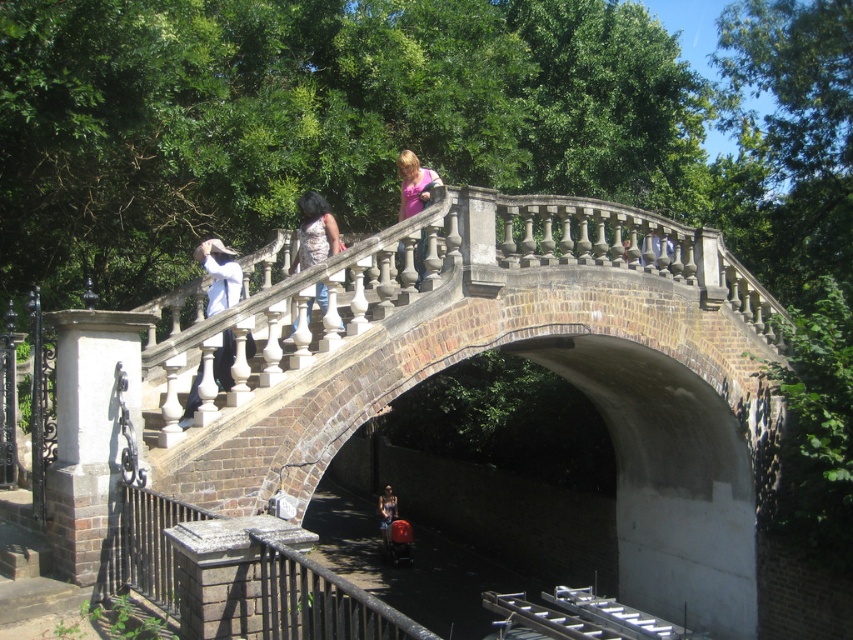
Is brown stone bridge at upper center bigger than dark blue jeans at center?

Yes, brown stone bridge at upper center is bigger than dark blue jeans at center.

From the picture: Between brown stone bridge at upper center and dark blue jeans at center, which one has less height?

Standing shorter between the two is dark blue jeans at center.

Is point (572, 330) closer to viewer compared to point (383, 524)?

Yes, point (572, 330) is in front of point (383, 524).

Locate an element on the screen. The image size is (853, 640). brown stone bridge at upper center is located at coordinates (450, 365).

Between brown stone bridge at upper center and matte white pants at upper center, which one has less height?

matte white pants at upper center is shorter.

Where is `brown stone bridge at upper center`? brown stone bridge at upper center is located at coordinates (450, 365).

Which is in front, point (345, 433) or point (666, 246)?

Positioned in front is point (345, 433).

Locate an element on the screen. This screenshot has height=640, width=853. brown stone bridge at upper center is located at coordinates (450, 365).

Does pink fabric at upper center appear under dark blue jeans at center?

Actually, pink fabric at upper center is above dark blue jeans at center.

Who is positioned more to the right, pink fabric at upper center or dark blue jeans at center?

pink fabric at upper center is more to the right.

Find the location of `pink fabric at upper center`. pink fabric at upper center is located at coordinates (415, 184).